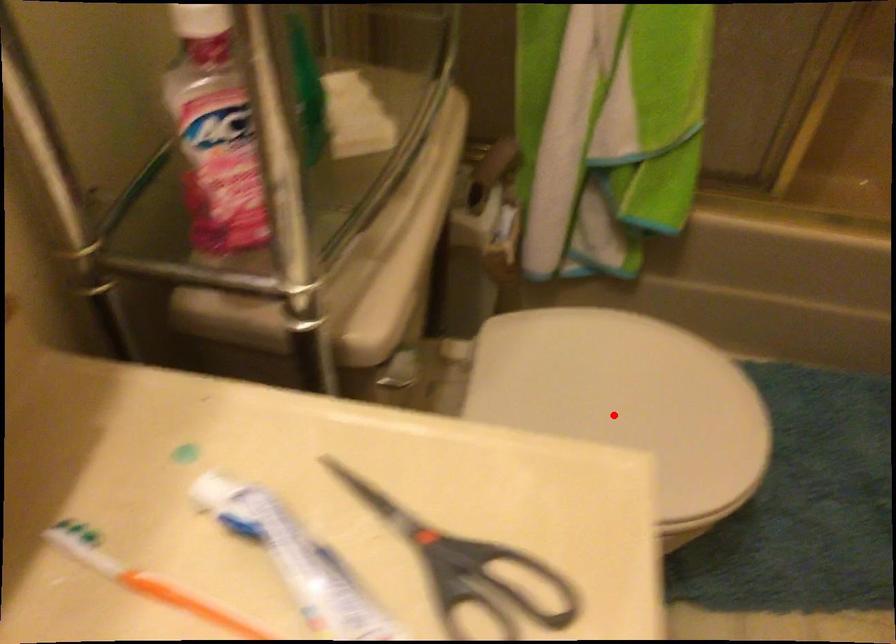
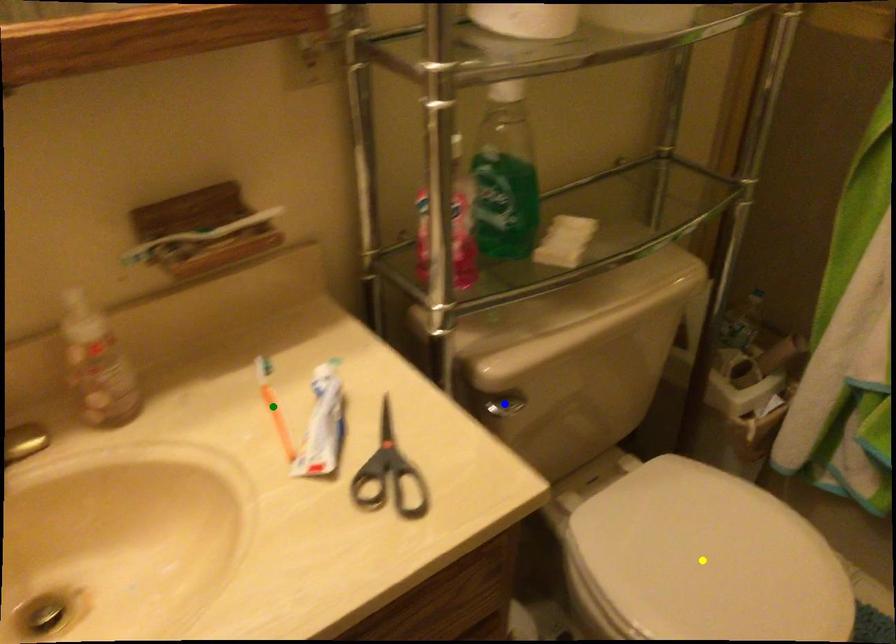
Question: I am providing you with two images of the same scene from different viewpoints. A red point is marked on the first image. You are given multiple points on the second image. Which mark in image 2 goes with the point in image 1?

Choices:
 (A) yellow point
 (B) green point
 (C) blue point

Answer: (A)